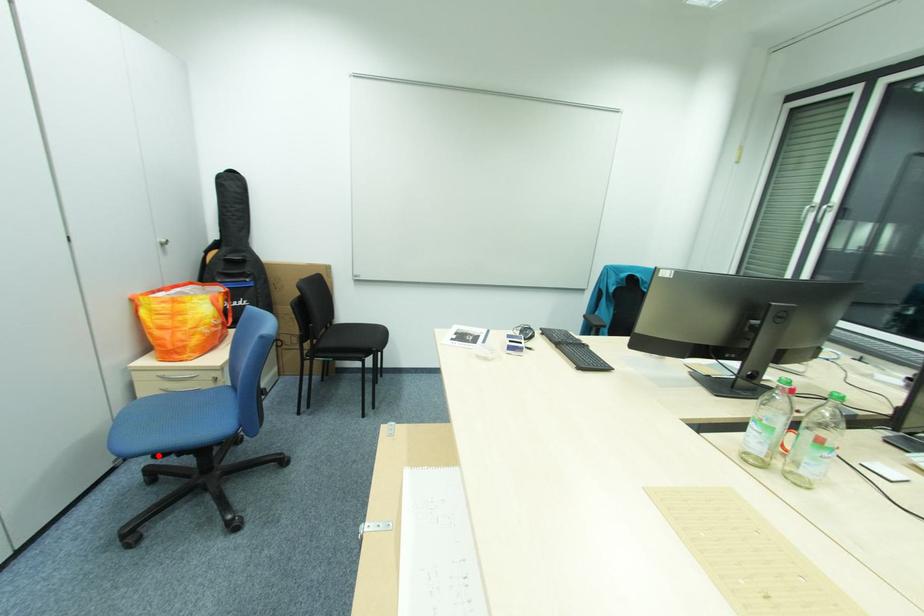
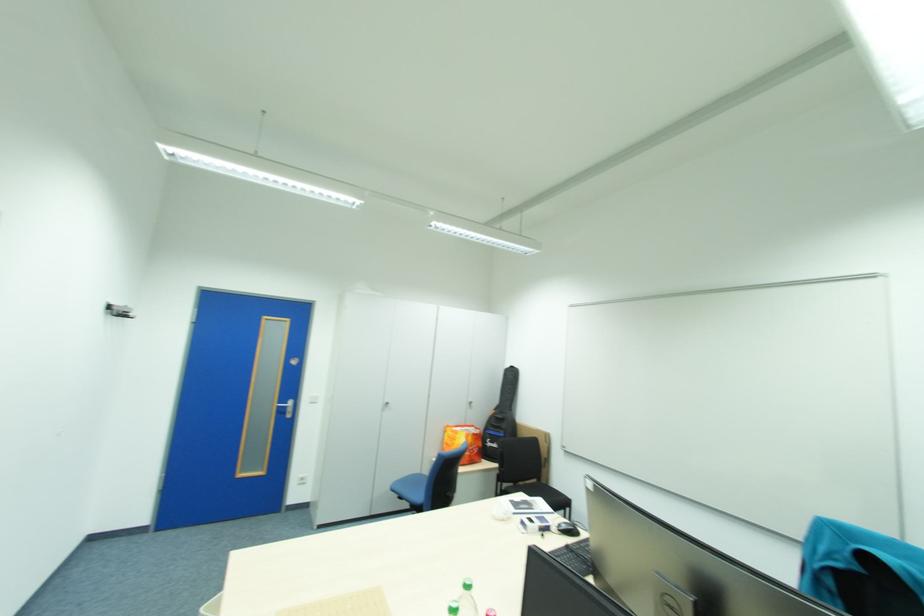
Find the pixel in the second image that matches the highlighted location in the first image.

(407, 495)